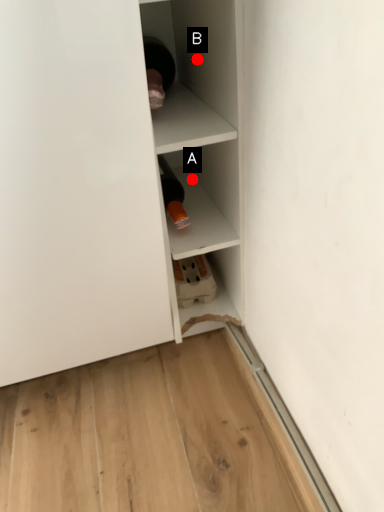
Question: Two points are circled on the image, labeled by A and B beside each circle. Among these points, which one is nearest to the camera?

Choices:
 (A) A is closer
 (B) B is closer

Answer: (B)